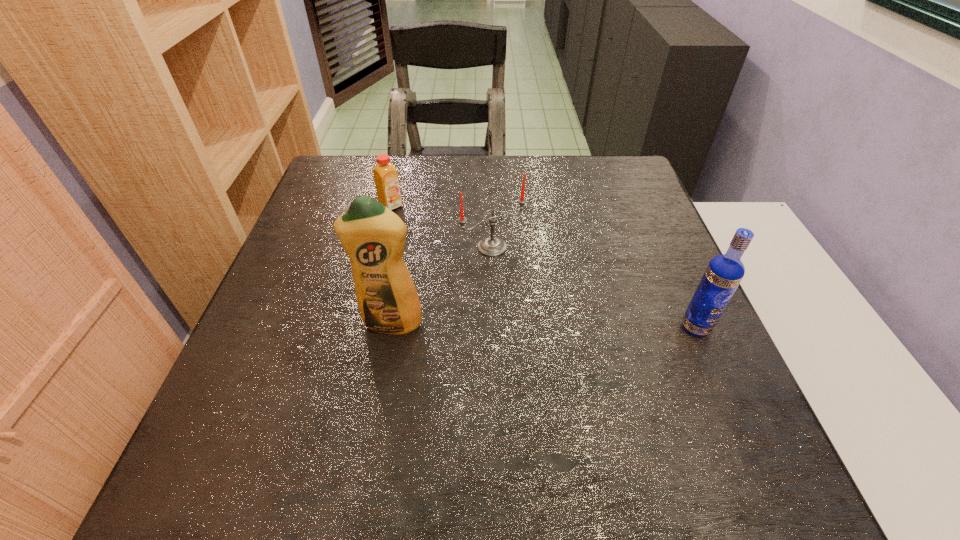
What are the coordinates of `detergent` in the screenshot? It's located at (373, 236).

Identify the location of vodka. [x=724, y=272].

Where is `the second tallest object`? The height and width of the screenshot is (540, 960). the second tallest object is located at coordinates (724, 272).

In order to click on the shortest object in this screenshot , I will do `click(386, 178)`.

Image resolution: width=960 pixels, height=540 pixels. What are the coordinates of `the farthest object` in the screenshot? It's located at (386, 178).

You are a GUI agent. You are given a task and a screenshot of the screen. Output one action in this format:
    pyautogui.click(x=<x>, y=<y>)
    Task: Click on the second object from right to left
    The height and width of the screenshot is (540, 960).
    Given the screenshot: What is the action you would take?
    pyautogui.click(x=491, y=246)

At what (x,y) coordinates should I click in order to perform the action: click on candle. Please return your answer as a coordinate pair (x, y). The height and width of the screenshot is (540, 960). Looking at the image, I should click on (491, 246).

You are a GUI agent. You are given a task and a screenshot of the screen. Output one action in this format:
    pyautogui.click(x=<x>, y=<y>)
    Task: Click on the vacant space located on the label of the detergent
    The width and height of the screenshot is (960, 540).
    Given the screenshot: What is the action you would take?
    pyautogui.click(x=378, y=397)

Locate an element on the screen. This screenshot has width=960, height=540. vacant point located on the left of the rightmost object is located at coordinates (636, 327).

This screenshot has height=540, width=960. What are the coordinates of `vacant region located on the front and back of the farthest object` in the screenshot? It's located at (439, 244).